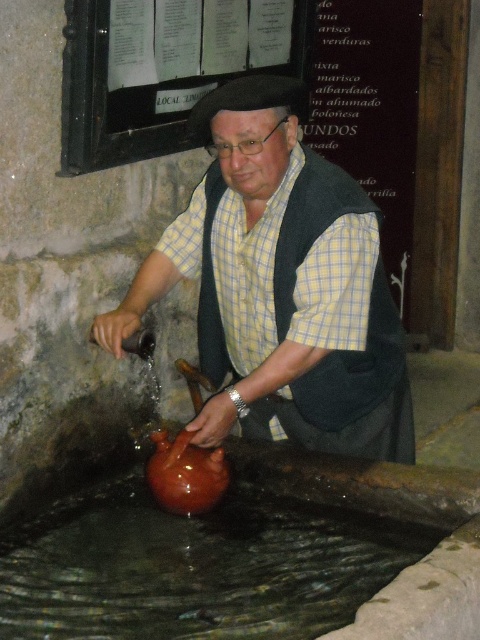
You are a visitor in a pottery workshop and see the matte brown jug at center and the brown matte water at lower center. The workshop has a strict rule that objects must be at least 60 centimeters apart for safety. Are these two items violating the rule?

The matte brown jug at center and brown matte water at lower center are 58.96 centimeters apart, which is less than the required 60 centimeters. Therefore, they are violating the workshop safety rule.

You are a photographer standing in front of the matte brown jug at center. You want to take a closeup shot of the jug without moving it. What is the minimum distance you need to move forward to get the jug into focus if your camera requires the subject to be at least 1.5 meters away?

The matte brown jug at center is currently 2.23 meters away from the camera. Since the camera requires the subject to be at least 1.5 meters away, you do not need to move forward. The jug is already within the required distance range for focusing.